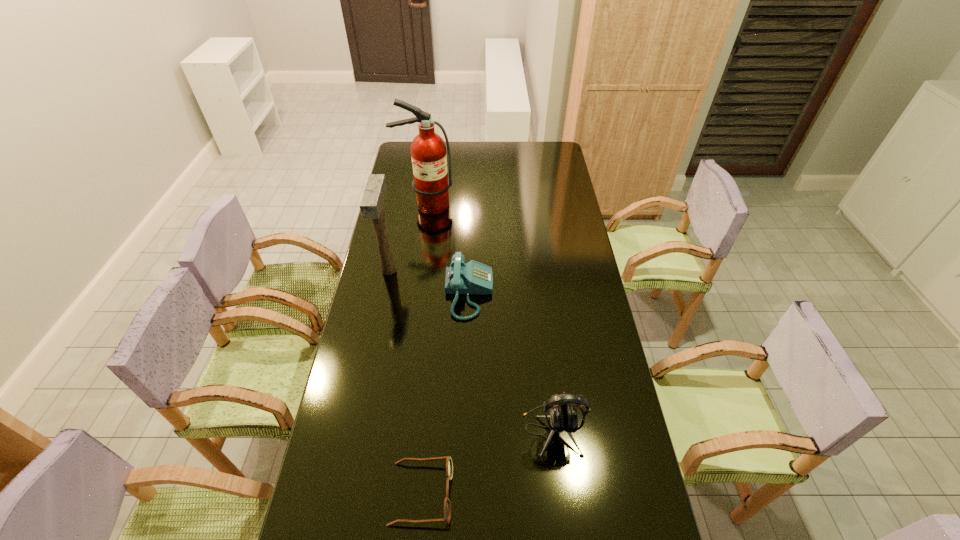
You are a GUI agent. You are given a task and a screenshot of the screen. Output one action in this format:
    pyautogui.click(x=<x>, y=<y>)
    Task: Click on the object that stands as the fourth closest to the spectacles
    
    Given the screenshot: What is the action you would take?
    pyautogui.click(x=431, y=183)

Locate an element on the screen. Image resolution: width=960 pixels, height=540 pixels. vacant space that satisfies the following two spatial constraints: 1. on the back side of the rightmost object; 2. on the dial of the telephone is located at coordinates click(x=536, y=293).